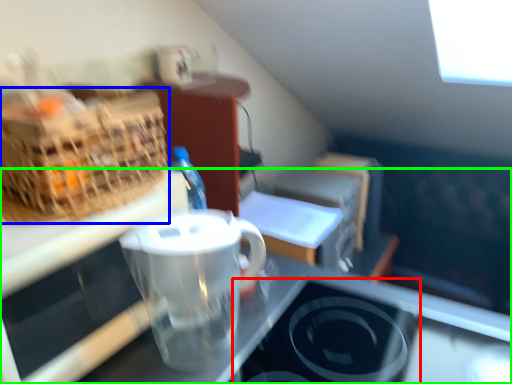
Question: Based on their relative distances, which object is farther from appliance (highlighted by a red box)? Choose from picnic basket (highlighted by a blue box) and desk (highlighted by a green box).

Choices:
 (A) picnic basket
 (B) desk

Answer: (A)